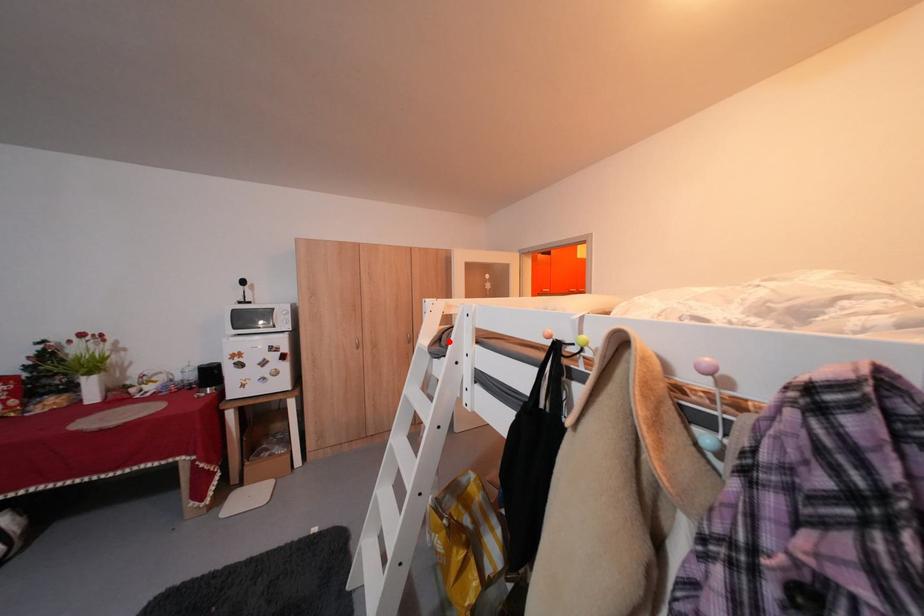
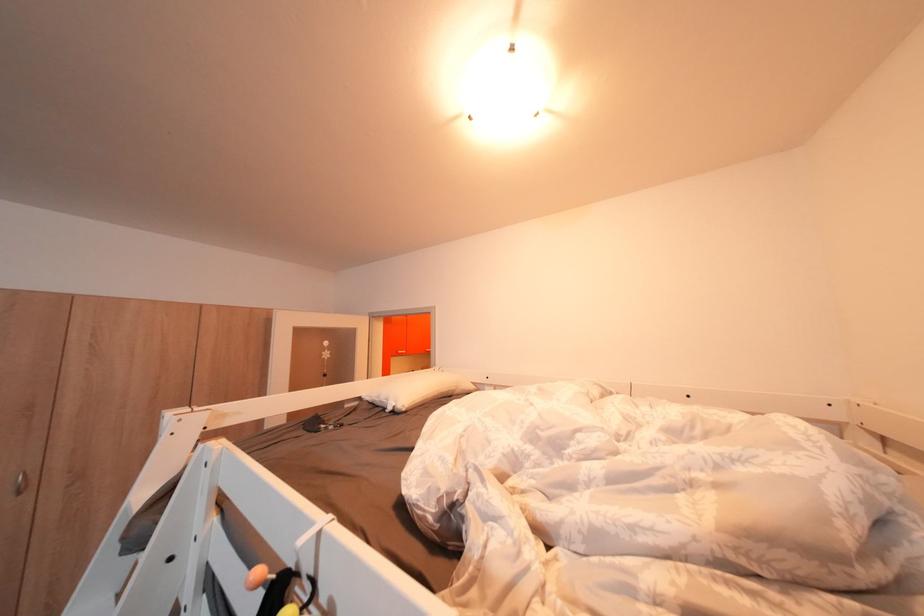
Find the pixel in the second image that matches the highlighted location in the first image.

(179, 493)